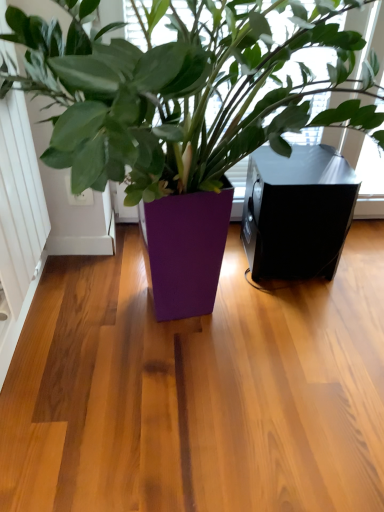
Locate an element on the screen. Image resolution: width=384 pixels, height=512 pixels. free space in front of black matte speaker at right is located at coordinates (292, 316).